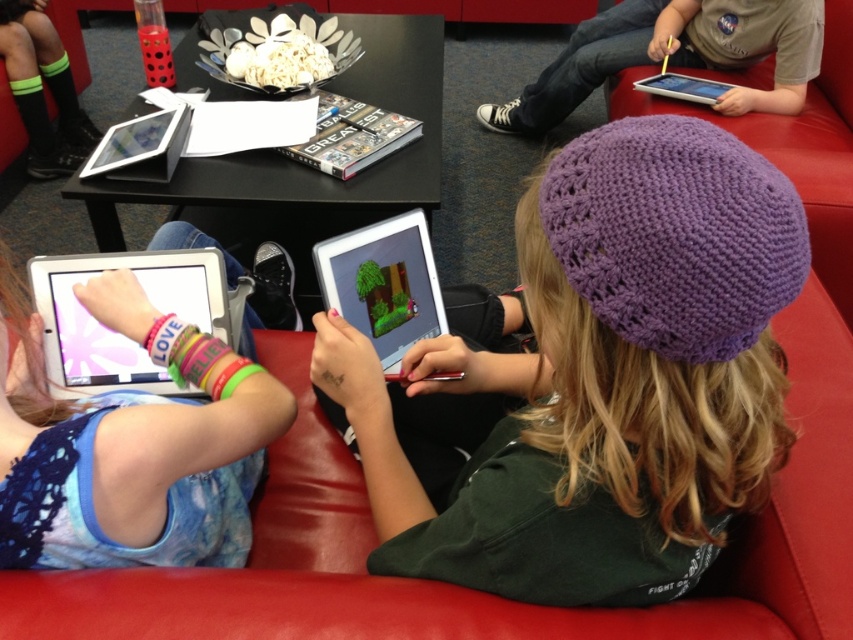
Question: Observing the image, what is the correct spatial positioning of white glossy tablet at center in reference to white glossy tablet at upper right?

Choices:
 (A) left
 (B) right

Answer: (A)

Question: Can you confirm if purple knitted beanie at center is positioned above white glossy tablet at left?

Choices:
 (A) no
 (B) yes

Answer: (A)

Question: Which point appears farthest from the camera in this image?

Choices:
 (A) (780, 141)
 (B) (175, 284)
 (C) (409, 284)
 (D) (679, 76)

Answer: (D)

Question: Observing the image, what is the correct spatial positioning of purple knitted hat at upper center in reference to white glossy tablet at center?

Choices:
 (A) above
 (B) below

Answer: (A)

Question: Which object appears closest to the camera in this image?

Choices:
 (A) white glossy tablet at center
 (B) matte purple beanie at upper right
 (C) purple knitted beanie at center

Answer: (C)

Question: Which of the following is the closest to the observer?

Choices:
 (A) purple knitted beanie at center
 (B) white glossy tablet at left
 (C) white glossy tablet at upper right

Answer: (A)